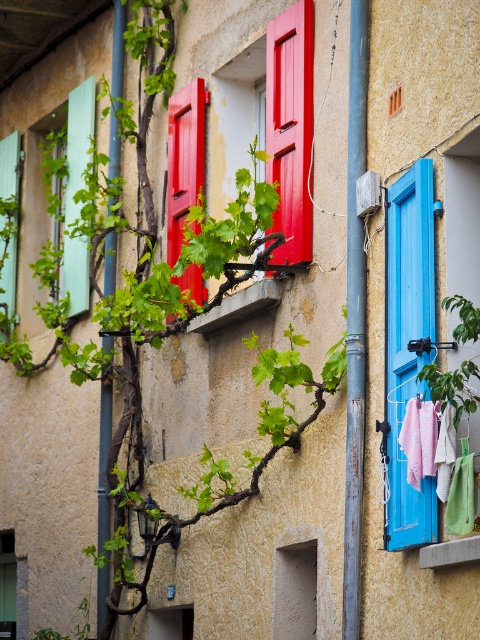
You are standing in front of a building with colorful shutters. You notice a point marked at coordinates (78, 141). Which object is located at that point?

The point at (78, 141) indicates the location of the matte green shutters at left.

You are a painter standing at the base of the building. You need to paint both the metallic pipe at left and the green fabric at right. If your ladder can extend up to 10 meters, can you safely reach both objects without moving the ladder?

The metallic pipe at left and green fabric at right are 13.93 meters apart, so the ladder can only reach up to 10 meters. Therefore, you cannot safely reach both objects without moving the ladder.

You are an interior designer assessing the space. You have a decorative item that is 1.2 meters wide and need to place it either on the blue painted wood at right or the green fabric at right. Based on their widths, which surface can accommodate the item?

The blue painted wood at right has a larger width than the green fabric at right, so the decorative item that is 1.2 meters wide can be placed on the blue painted wood at right.